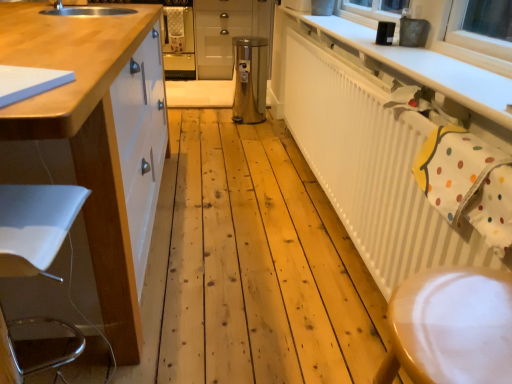
The height and width of the screenshot is (384, 512). Describe the element at coordinates (35, 226) in the screenshot. I see `white plastic swivel chair at left` at that location.

This screenshot has height=384, width=512. What do you see at coordinates (250, 79) in the screenshot? I see `stainless steel trash can at center` at bounding box center [250, 79].

Measure the distance between point (493, 77) and camera.

Point (493, 77) is 1.24 meters away from camera.

Image resolution: width=512 pixels, height=384 pixels. What do you see at coordinates (228, 32) in the screenshot? I see `metallic silver cabinet at center, the 2th cabinetry in the front-to-back sequence` at bounding box center [228, 32].

What are the coordinates of `white glossy cabinet at left, marked as the 1th cabinetry in a front-to-back arrangement` in the screenshot? It's located at (85, 138).

Which object is further away from the camera, metallic silver cabinet at center, which appears as the 1th cabinetry when viewed from the top, or white textured radiator at upper right?

Positioned behind is metallic silver cabinet at center, which appears as the 1th cabinetry when viewed from the top.

From a real-world perspective, is metallic silver cabinet at center, the 2th cabinetry from the bottom, positioned over white textured radiator at upper right based on gravity?

Yes, from a real-world perspective, metallic silver cabinet at center, the 2th cabinetry from the bottom, is over white textured radiator at upper right

What's the angular difference between metallic silver cabinet at center, the 2th cabinetry in the front-to-back sequence, and white textured radiator at upper right's facing directions?

The angular difference between metallic silver cabinet at center, the 2th cabinetry in the front-to-back sequence, and white textured radiator at upper right is 91.4 degrees.

The height and width of the screenshot is (384, 512). Find the location of `swivel chair behind the white glossy cabinet at left, which is counted as the second cabinetry, starting from the top`. swivel chair behind the white glossy cabinet at left, which is counted as the second cabinetry, starting from the top is located at coordinates (35, 226).

Is white glossy cabinet at left, which is counted as the second cabinetry, starting from the top, aimed at white plastic swivel chair at left?

No, white glossy cabinet at left, which is counted as the second cabinetry, starting from the top, does not turn towards white plastic swivel chair at left.

From the image's perspective, is white glossy cabinet at left, marked as the 1th cabinetry in a front-to-back arrangement, on top of white plastic swivel chair at left?

Yes.

From the image's perspective, which one is positioned lower, white glossy cabinet at left, which appears as the first cabinetry when ordered from the bottom, or wooden step stool at lower right?

From the image's view, wooden step stool at lower right is below.

Considering the sizes of white glossy cabinet at left, the second cabinetry positioned from the back, and wooden step stool at lower right in the image, is white glossy cabinet at left, the second cabinetry positioned from the back, taller or shorter than wooden step stool at lower right?

white glossy cabinet at left, the second cabinetry positioned from the back, is taller than wooden step stool at lower right.

From a real-world perspective, which object stands above the other?

wooden step stool at lower right, from a real-world perspective.

Between white textured radiator at upper right and stainless steel trash can at center, which one has less height?

stainless steel trash can at center.

Considering the relative sizes of white textured radiator at upper right and stainless steel trash can at center in the image provided, is white textured radiator at upper right wider than stainless steel trash can at center?

No, white textured radiator at upper right is not wider than stainless steel trash can at center.

Would you say white textured radiator at upper right is a long distance from stainless steel trash can at center?

white textured radiator at upper right is far away from stainless steel trash can at center.

Considering the positions of objects stainless steel trash can at center and white textured radiator at upper right in the image provided, who is in front, stainless steel trash can at center or white textured radiator at upper right?

white textured radiator at upper right is more forward.

From a real-world perspective, is stainless steel trash can at center on white textured radiator at upper right?

No, from a real-world perspective, stainless steel trash can at center is not on top of white textured radiator at upper right.

From the picture: Can you confirm if white matte countertop at upper right is bigger than white glossy cabinet at left, which is counted as the second cabinetry, starting from the top?

Actually, white matte countertop at upper right might be smaller than white glossy cabinet at left, which is counted as the second cabinetry, starting from the top.

Considering the relative sizes of white matte countertop at upper right and white glossy cabinet at left, the second cabinetry positioned from the back, in the image provided, is white matte countertop at upper right wider than white glossy cabinet at left, the second cabinetry positioned from the back,?

Incorrect, the width of white matte countertop at upper right does not surpass that of white glossy cabinet at left, the second cabinetry positioned from the back.

Does white matte countertop at upper right have a lesser height compared to white glossy cabinet at left, which is counted as the second cabinetry, starting from the top?

Yes, white matte countertop at upper right is shorter than white glossy cabinet at left, which is counted as the second cabinetry, starting from the top.

From the picture: From a real-world perspective, is white matte countertop at upper right above or below white glossy cabinet at left, the second cabinetry positioned from the back?

From a real-world perspective, white matte countertop at upper right is physically above white glossy cabinet at left, the second cabinetry positioned from the back.

Could white glossy cabinet at left, the second cabinetry positioned from the back, be considered to be inside white textured radiator at upper right?

Actually, white glossy cabinet at left, the second cabinetry positioned from the back, is outside white textured radiator at upper right.

Can you confirm if white textured radiator at upper right is thinner than white glossy cabinet at left, which appears as the first cabinetry when ordered from the bottom?

Indeed, white textured radiator at upper right has a lesser width compared to white glossy cabinet at left, which appears as the first cabinetry when ordered from the bottom.

How many degrees apart are the facing directions of white textured radiator at upper right and white glossy cabinet at left, which appears as the first cabinetry when ordered from the bottom?

0.204 degrees.

From a real-world perspective, which object rests below the other?

white textured radiator at upper right, from a real-world perspective.

From a real-world perspective, starting from the white textured radiator at upper right, which cabinetry is the 2nd one vertically above it? Please provide its 2D coordinates.

[(228, 32)]

What are the coordinates of `swivel chair below the white glossy cabinet at left, the second cabinetry positioned from the back (from the image's perspective)` in the screenshot? It's located at (35, 226).

Based on their spatial positions, is stainless steel trash can at center or white plastic swivel chair at left further from metallic silver cabinet at center, the 2th cabinetry from the bottom?

white plastic swivel chair at left is further to metallic silver cabinet at center, the 2th cabinetry from the bottom.

When comparing their distances from wooden step stool at lower right, does metallic silver cabinet at center, placed as the 1th cabinetry when sorted from back to front, or white textured radiator at upper right seem further?

metallic silver cabinet at center, placed as the 1th cabinetry when sorted from back to front, lies further to wooden step stool at lower right than the other object.

From the image, which object appears to be farther from white textured radiator at upper right, white matte countertop at upper right or white glossy cabinet at left, which is counted as the second cabinetry, starting from the top?

The object further to white textured radiator at upper right is white glossy cabinet at left, which is counted as the second cabinetry, starting from the top.

Looking at the image, which one is located closer to white glossy cabinet at left, marked as the 1th cabinetry in a front-to-back arrangement, white plastic swivel chair at left or white matte countertop at upper right?

Based on the image, white plastic swivel chair at left appears to be nearer to white glossy cabinet at left, marked as the 1th cabinetry in a front-to-back arrangement.

Based on their spatial positions, is white plastic swivel chair at left or white glossy cabinet at left, marked as the 1th cabinetry in a front-to-back arrangement, closer to white textured radiator at upper right?

The object closer to white textured radiator at upper right is white glossy cabinet at left, marked as the 1th cabinetry in a front-to-back arrangement.

Consider the image. Estimate the real-world distances between objects in this image. Which object is further from stainless steel trash can at center, white glossy cabinet at left, which is counted as the second cabinetry, starting from the top, or wooden step stool at lower right?

The object further to stainless steel trash can at center is wooden step stool at lower right.

When comparing their distances from white glossy cabinet at left, the second cabinetry positioned from the back, does stainless steel trash can at center or white matte countertop at upper right seem further?

Among the two, stainless steel trash can at center is located further to white glossy cabinet at left, the second cabinetry positioned from the back.

Looking at the image, which one is located further to white plastic swivel chair at left, wooden step stool at lower right or white glossy cabinet at left, which appears as the first cabinetry when ordered from the bottom?

Among the two, wooden step stool at lower right is located further to white plastic swivel chair at left.

This screenshot has width=512, height=384. In order to click on swivel chair situated between white glossy cabinet at left, which is counted as the second cabinetry, starting from the top, and wooden step stool at lower right from left to right in this screenshot , I will do `click(35, 226)`.

Where is `step stool located between white glossy cabinet at left, which appears as the first cabinetry when ordered from the bottom, and white matte countertop at upper right in the left-right direction`? step stool located between white glossy cabinet at left, which appears as the first cabinetry when ordered from the bottom, and white matte countertop at upper right in the left-right direction is located at coordinates (451, 327).

Where is `radiator positioned between wooden step stool at lower right and metallic silver cabinet at center, which appears as the 1th cabinetry when viewed from the top, from near to far`? This screenshot has height=384, width=512. radiator positioned between wooden step stool at lower right and metallic silver cabinet at center, which appears as the 1th cabinetry when viewed from the top, from near to far is located at coordinates (371, 168).

Where is `appliance positioned between white glossy cabinet at left, which is counted as the second cabinetry, starting from the top, and metallic silver cabinet at center, placed as the 1th cabinetry when sorted from back to front, from near to far`? This screenshot has width=512, height=384. appliance positioned between white glossy cabinet at left, which is counted as the second cabinetry, starting from the top, and metallic silver cabinet at center, placed as the 1th cabinetry when sorted from back to front, from near to far is located at coordinates (250, 79).